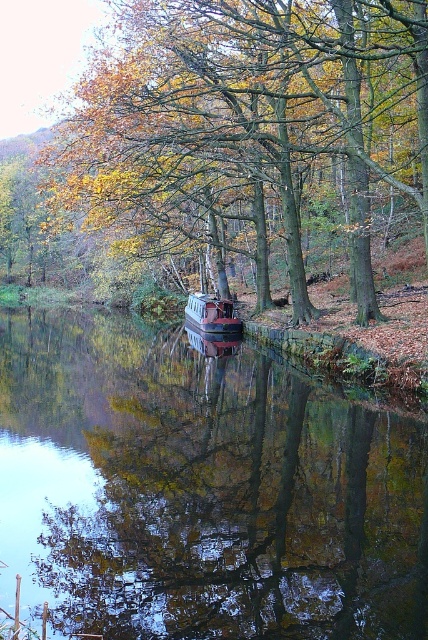
Find the location of a particular element. This screenshot has height=640, width=428. smooth reflective water at center is located at coordinates (201, 490).

Is smooth reflective water at center to the right of matte red boat at center from the viewer's perspective?

Yes, smooth reflective water at center is to the right of matte red boat at center.

Does point (59, 376) lie behind point (228, 330)?

No.

Image resolution: width=428 pixels, height=640 pixels. In order to click on smooth reflective water at center in this screenshot , I will do `click(201, 490)`.

Which is more to the right, smooth reflective water at center or golden wood tree at center?

smooth reflective water at center is more to the right.

Looking at this image, between smooth reflective water at center and golden wood tree at center, which one has less height?

Standing shorter between the two is smooth reflective water at center.

Is point (27, 390) positioned after point (162, 131)?

That is False.

Locate an element on the screen. Image resolution: width=428 pixels, height=640 pixels. smooth reflective water at center is located at coordinates 201,490.

Who is positioned more to the right, golden wood tree at center or matte red boat at center?

matte red boat at center is more to the right.

Find the location of a particular element. golden wood tree at center is located at coordinates (246, 118).

Is point (407, 170) in front of point (231, 305)?

Yes.

Where is `golden wood tree at center`? The height and width of the screenshot is (640, 428). golden wood tree at center is located at coordinates (246, 118).